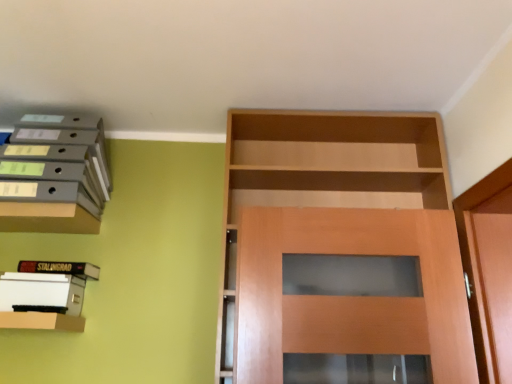
The width and height of the screenshot is (512, 384). Describe the element at coordinates (54, 175) in the screenshot. I see `matte gray folders at upper left, which is counted as the 1th shelf, starting from the top` at that location.

In order to face matte wood shelf at upper left, should I rotate leftwards or rightwards?

Rotate left and turn 27.100 degrees.

The width and height of the screenshot is (512, 384). In order to click on matte wood shelf at lower left, the second shelf positioned from the top in this screenshot , I will do `click(41, 321)`.

Is matte wood shelf at upper left positioned with its back to matte wood shelf at lower left, the 1th shelf positioned from the bottom?

No, matte wood shelf at lower left, the 1th shelf positioned from the bottom, is not at the back of matte wood shelf at upper left.

Which object is further away from the camera taking this photo, matte wood shelf at upper left or matte wood shelf at lower left, the second shelf positioned from the top?

Positioned behind is matte wood shelf at upper left.

Does point (60, 232) come in front of point (18, 318)?

No, (60, 232) is further to viewer.

Is matte wood shelf at upper left positioned far away from matte wood shelf at lower left, the 1th shelf positioned from the bottom?

No.

From a real-world perspective, between hardcover book at upper left, which appears as the 1th book when viewed from the top, and matte wood shelf at lower left, the 1th shelf positioned from the bottom, who is vertically higher?

hardcover book at upper left, which appears as the 1th book when viewed from the top, from a real-world perspective.

Can matte wood shelf at lower left, the second shelf positioned from the top, be found inside hardcover book at upper left, placed as the 2th book when sorted from bottom to top?

Definitely not — matte wood shelf at lower left, the second shelf positioned from the top, is not inside hardcover book at upper left, placed as the 2th book when sorted from bottom to top.

Consider the image. Considering the positions of objects hardcover book at upper left, which appears as the 1th book when viewed from the top, and matte wood shelf at lower left, the 1th shelf positioned from the bottom, in the image provided, who is more to the left, hardcover book at upper left, which appears as the 1th book when viewed from the top, or matte wood shelf at lower left, the 1th shelf positioned from the bottom,?

matte wood shelf at lower left, the 1th shelf positioned from the bottom, is more to the left.

Between hardcover book at upper left, which appears as the 1th book when viewed from the top, and matte wood shelf at lower left, the second shelf positioned from the top, which one has larger width?

matte wood shelf at lower left, the second shelf positioned from the top, is wider.

Is matte wood shelf at lower left, the second shelf positioned from the top, turned away from matte wood shelf at upper left?

matte wood shelf at lower left, the second shelf positioned from the top, is not turned away from matte wood shelf at upper left.

Is matte wood shelf at lower left, the 1th shelf positioned from the bottom, far away from matte wood shelf at upper left?

No, matte wood shelf at lower left, the 1th shelf positioned from the bottom, is not far away from matte wood shelf at upper left.

From the image's perspective, which is below, matte wood shelf at lower left, the 1th shelf positioned from the bottom, or matte wood shelf at upper left?

matte wood shelf at lower left, the 1th shelf positioned from the bottom, appears lower in the image.

Between white paper at left, which ranks as the 1th book in bottom-to-top order, and matte wood shelf at upper left, which one has larger size?

With larger size is white paper at left, which ranks as the 1th book in bottom-to-top order.

From the image's perspective, relative to matte wood shelf at upper left, is white paper at left, positioned as the 2th book in top-to-bottom order, above or below?

From the image's perspective, white paper at left, positioned as the 2th book in top-to-bottom order, appears below matte wood shelf at upper left.

Which is closer to the camera, (54, 272) or (90, 218)?

Point (54, 272).

Does matte wood shelf at upper left have a larger size compared to white paper at left, positioned as the 2th book in top-to-bottom order?

No.

Is matte wood shelf at upper left looking in the opposite direction of white paper at left, which ranks as the 1th book in bottom-to-top order?

No, matte wood shelf at upper left is not facing the opposite direction of white paper at left, which ranks as the 1th book in bottom-to-top order.

From a real-world perspective, is matte wood shelf at upper left over white paper at left, which ranks as the 1th book in bottom-to-top order?

Yes, from a real-world perspective, matte wood shelf at upper left is on top of white paper at left, which ranks as the 1th book in bottom-to-top order.

Who is bigger, hardcover book at upper left, which appears as the 1th book when viewed from the top, or matte wood shelf at upper left?

matte wood shelf at upper left.

Which is more to the right, hardcover book at upper left, placed as the 2th book when sorted from bottom to top, or matte wood shelf at upper left?

Positioned to the right is hardcover book at upper left, placed as the 2th book when sorted from bottom to top.

Can matte wood shelf at upper left be found inside hardcover book at upper left, placed as the 2th book when sorted from bottom to top?

No.

Based on the photo, can you confirm if hardcover book at upper left, which appears as the 1th book when viewed from the top, is thinner than matte wood shelf at upper left?

Correct, the width of hardcover book at upper left, which appears as the 1th book when viewed from the top, is less than that of matte wood shelf at upper left.

From the image's perspective, who appears lower, white paper at left, positioned as the 2th book in top-to-bottom order, or hardcover book at upper left, which appears as the 1th book when viewed from the top?

white paper at left, positioned as the 2th book in top-to-bottom order, from the image's perspective.

Could you tell me if white paper at left, which ranks as the 1th book in bottom-to-top order, is facing hardcover book at upper left, placed as the 2th book when sorted from bottom to top?

Yes, white paper at left, which ranks as the 1th book in bottom-to-top order, is oriented towards hardcover book at upper left, placed as the 2th book when sorted from bottom to top.

Can hardcover book at upper left, which appears as the 1th book when viewed from the top, be found inside white paper at left, positioned as the 2th book in top-to-bottom order?

Yes, hardcover book at upper left, which appears as the 1th book when viewed from the top, is a part of white paper at left, positioned as the 2th book in top-to-bottom order.

Does white paper at left, positioned as the 2th book in top-to-bottom order, touch hardcover book at upper left, which appears as the 1th book when viewed from the top?

Yes.

Identify the location of shelf lying on the right of matte wood shelf at upper left. The image size is (512, 384). (41, 321).

In the image, there is a hardcover book at upper left, which appears as the 1th book when viewed from the top. Where is `shelf below it (from a real-world perspective)`? This screenshot has height=384, width=512. shelf below it (from a real-world perspective) is located at coordinates (41, 321).

From the image, which object appears to be nearer to matte gray folders at upper left, marked as the 2th shelf in a bottom-to-top arrangement, matte wood shelf at lower left, the 1th shelf positioned from the bottom, or hardcover book at upper left, which appears as the 1th book when viewed from the top?

The object closer to matte gray folders at upper left, marked as the 2th shelf in a bottom-to-top arrangement, is hardcover book at upper left, which appears as the 1th book when viewed from the top.

Looking at the image, which one is located closer to matte gray folders at upper left, marked as the 2th shelf in a bottom-to-top arrangement, matte wood shelf at upper left or matte wood shelf at lower left, the 1th shelf positioned from the bottom?

matte wood shelf at upper left.

Looking at the image, which one is located closer to matte gray folders at upper left, which is counted as the 1th shelf, starting from the top, white paper at left, which ranks as the 1th book in bottom-to-top order, or matte wood shelf at lower left, the second shelf positioned from the top?

Among the two, white paper at left, which ranks as the 1th book in bottom-to-top order, is located nearer to matte gray folders at upper left, which is counted as the 1th shelf, starting from the top.

Estimate the real-world distances between objects in this image. Which object is closer to matte wood shelf at lower left, the 1th shelf positioned from the bottom, hardcover book at upper left, placed as the 2th book when sorted from bottom to top, or matte gray folders at upper left, marked as the 2th shelf in a bottom-to-top arrangement?

hardcover book at upper left, placed as the 2th book when sorted from bottom to top, lies closer to matte wood shelf at lower left, the 1th shelf positioned from the bottom, than the other object.

Considering their positions, is white paper at left, positioned as the 2th book in top-to-bottom order, positioned further to matte wood shelf at upper left than hardcover book at upper left, placed as the 2th book when sorted from bottom to top?

The object further to matte wood shelf at upper left is white paper at left, positioned as the 2th book in top-to-bottom order.

Which object lies nearer to the anchor point matte wood shelf at lower left, the 1th shelf positioned from the bottom, white paper at left, positioned as the 2th book in top-to-bottom order, or hardcover book at upper left, which appears as the 1th book when viewed from the top?

white paper at left, positioned as the 2th book in top-to-bottom order, lies closer to matte wood shelf at lower left, the 1th shelf positioned from the bottom, than the other object.

When comparing their distances from matte gray folders at upper left, which is counted as the 1th shelf, starting from the top, does matte wood shelf at lower left, the 1th shelf positioned from the bottom, or white paper at left, which ranks as the 1th book in bottom-to-top order, seem closer?

white paper at left, which ranks as the 1th book in bottom-to-top order.

Considering their positions, is white paper at left, positioned as the 2th book in top-to-bottom order, positioned closer to matte wood shelf at upper left than matte gray folders at upper left, marked as the 2th shelf in a bottom-to-top arrangement?

Based on the image, matte gray folders at upper left, marked as the 2th shelf in a bottom-to-top arrangement, appears to be nearer to matte wood shelf at upper left.

The height and width of the screenshot is (384, 512). I want to click on book between matte wood shelf at upper left and white paper at left, which ranks as the 1th book in bottom-to-top order, in the vertical direction, so click(61, 268).

Locate an element on the screen. This screenshot has width=512, height=384. cabinetry that lies between matte gray folders at upper left, which is counted as the 1th shelf, starting from the top, and hardcover book at upper left, which appears as the 1th book when viewed from the top, from top to bottom is located at coordinates (47, 218).

Find the location of a particular element. The height and width of the screenshot is (384, 512). cabinetry between matte gray folders at upper left, marked as the 2th shelf in a bottom-to-top arrangement, and matte wood shelf at lower left, the second shelf positioned from the top, in the vertical direction is located at coordinates (47, 218).

You are a GUI agent. You are given a task and a screenshot of the screen. Output one action in this format:
    pyautogui.click(x=<x>, y=<y>)
    Task: Click on the book that lies between matte gray folders at upper left, which is counted as the 1th shelf, starting from the top, and white paper at left, positioned as the 2th book in top-to-bottom order, from top to bottom
    
    Given the screenshot: What is the action you would take?
    pyautogui.click(x=61, y=268)